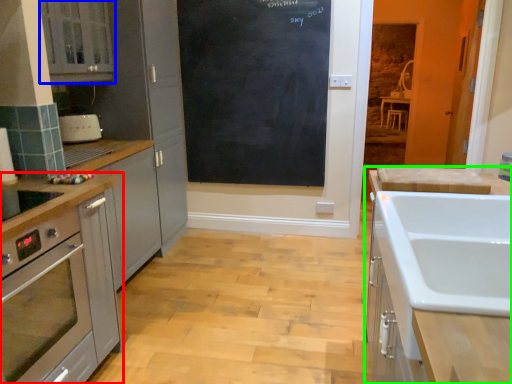
Question: Based on their relative distances, which object is farther from cabinetry (highlighted by a red box)? Choose from cabinetry (highlighted by a blue box) and cabinetry (highlighted by a green box).

Choices:
 (A) cabinetry
 (B) cabinetry

Answer: (B)